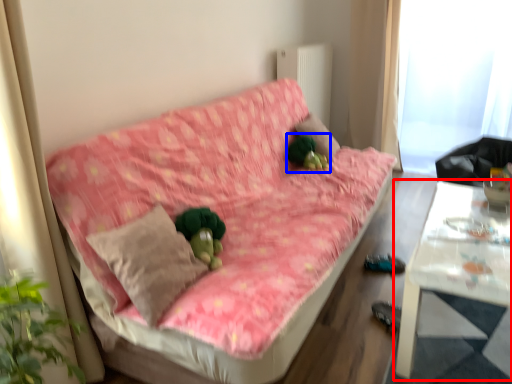
Question: Which object appears closest to the camera in this image, table (highlighted by a red box) or toy (highlighted by a blue box)?

Choices:
 (A) table
 (B) toy

Answer: (A)